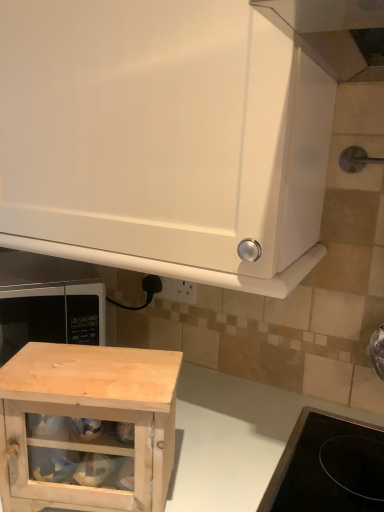
Question: Is white glossy cabinet at upper center, the first cabinetry from the top, taller than natural wood cabinet at lower left, which is counted as the first cabinetry, starting from the bottom?

Choices:
 (A) yes
 (B) no

Answer: (A)

Question: Can you confirm if white glossy cabinet at upper center, the first cabinetry from the top, is shorter than natural wood cabinet at lower left, marked as the second cabinetry in a top-to-bottom arrangement?

Choices:
 (A) no
 (B) yes

Answer: (A)

Question: Is white glossy cabinet at upper center, the first cabinetry from the top, outside natural wood cabinet at lower left, marked as the second cabinetry in a top-to-bottom arrangement?

Choices:
 (A) yes
 (B) no

Answer: (A)

Question: Does white glossy cabinet at upper center, the first cabinetry from the top, have a greater width compared to natural wood cabinet at lower left, marked as the second cabinetry in a top-to-bottom arrangement?

Choices:
 (A) yes
 (B) no

Answer: (A)

Question: From a real-world perspective, does white glossy cabinet at upper center, acting as the 2th cabinetry starting from the bottom, stand above natural wood cabinet at lower left, which is counted as the first cabinetry, starting from the bottom?

Choices:
 (A) no
 (B) yes

Answer: (B)

Question: Does white glossy cabinet at upper center, acting as the 2th cabinetry starting from the bottom, have a larger size compared to natural wood cabinet at lower left, marked as the second cabinetry in a top-to-bottom arrangement?

Choices:
 (A) yes
 (B) no

Answer: (A)

Question: Is natural wood cabinet at lower center smaller than natural wood cabinet at lower left, which is counted as the first cabinetry, starting from the bottom?

Choices:
 (A) yes
 (B) no

Answer: (B)

Question: Does natural wood cabinet at lower center turn towards natural wood cabinet at lower left, marked as the second cabinetry in a top-to-bottom arrangement?

Choices:
 (A) yes
 (B) no

Answer: (B)

Question: Considering the relative sizes of natural wood cabinet at lower center and natural wood cabinet at lower left, which is counted as the first cabinetry, starting from the bottom, in the image provided, is natural wood cabinet at lower center wider than natural wood cabinet at lower left, which is counted as the first cabinetry, starting from the bottom,?

Choices:
 (A) no
 (B) yes

Answer: (B)

Question: Is natural wood cabinet at lower center taller than natural wood cabinet at lower left, which is counted as the first cabinetry, starting from the bottom?

Choices:
 (A) no
 (B) yes

Answer: (B)

Question: Is natural wood cabinet at lower center far away from natural wood cabinet at lower left, which is counted as the first cabinetry, starting from the bottom?

Choices:
 (A) no
 (B) yes

Answer: (A)

Question: From a real-world perspective, is natural wood cabinet at lower center beneath natural wood cabinet at lower left, which is counted as the first cabinetry, starting from the bottom?

Choices:
 (A) yes
 (B) no

Answer: (A)

Question: Does natural wood cabinet at lower center have a greater height compared to white glossy cabinet at upper center, the first cabinetry from the top?

Choices:
 (A) no
 (B) yes

Answer: (B)